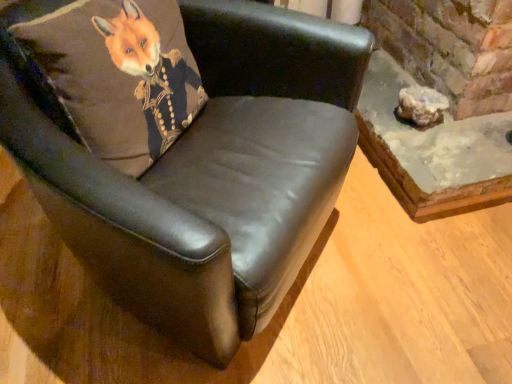
You are a GUI agent. You are given a task and a screenshot of the screen. Output one action in this format:
    pyautogui.click(x=<x>, y=<y>)
    Task: Click on the vacant area on the back side of translucent white rock at lower right
    
    Given the screenshot: What is the action you would take?
    pyautogui.click(x=392, y=91)